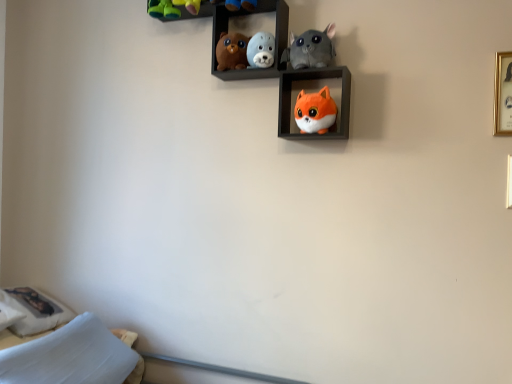
Question: From the image's perspective, is gold metallic picture frame at upper right on top of white soft pillow at lower left, the 1th pillow in the left-to-right sequence?

Choices:
 (A) no
 (B) yes

Answer: (B)

Question: Can you confirm if gold metallic picture frame at upper right is taller than white soft pillow at lower left, arranged as the 2th pillow when viewed from the right?

Choices:
 (A) no
 (B) yes

Answer: (B)

Question: Is white soft pillow at lower left, the 1th pillow in the left-to-right sequence, at the back of gold metallic picture frame at upper right?

Choices:
 (A) yes
 (B) no

Answer: (B)

Question: Is white soft pillow at lower left, the 1th pillow in the left-to-right sequence, located within gold metallic picture frame at upper right?

Choices:
 (A) yes
 (B) no

Answer: (B)

Question: From a real-world perspective, is gold metallic picture frame at upper right below white soft pillow at lower left, the 1th pillow in the left-to-right sequence?

Choices:
 (A) no
 (B) yes

Answer: (A)

Question: Can you confirm if gold metallic picture frame at upper right is bigger than white soft pillow at lower left, the 1th pillow in the left-to-right sequence?

Choices:
 (A) yes
 (B) no

Answer: (B)

Question: Considering the relative sizes of white soft pillow at lower left, arranged as the 2th pillow when viewed from the right, and matte brown plush bear at upper center, positioned as the first toy in left-to-right order, in the image provided, is white soft pillow at lower left, arranged as the 2th pillow when viewed from the right, bigger than matte brown plush bear at upper center, positioned as the first toy in left-to-right order,?

Choices:
 (A) no
 (B) yes

Answer: (B)

Question: Is white soft pillow at lower left, the 1th pillow in the left-to-right sequence, completely or partially outside of matte brown plush bear at upper center, positioned as the first toy in left-to-right order?

Choices:
 (A) no
 (B) yes

Answer: (B)

Question: Could matte brown plush bear at upper center, marked as the 4th toy in a right-to-left arrangement, be considered to be inside white soft pillow at lower left, the 1th pillow in the left-to-right sequence?

Choices:
 (A) yes
 (B) no

Answer: (B)

Question: Is white soft pillow at lower left, the 1th pillow in the left-to-right sequence, closer to the viewer compared to matte brown plush bear at upper center, positioned as the first toy in left-to-right order?

Choices:
 (A) no
 (B) yes

Answer: (A)

Question: From a real-world perspective, is white soft pillow at lower left, the 1th pillow in the left-to-right sequence, physically below matte brown plush bear at upper center, positioned as the first toy in left-to-right order?

Choices:
 (A) yes
 (B) no

Answer: (A)

Question: Would you consider white soft pillow at lower left, the 1th pillow in the left-to-right sequence, to be distant from matte brown plush bear at upper center, positioned as the first toy in left-to-right order?

Choices:
 (A) no
 (B) yes

Answer: (B)

Question: Considering the relative sizes of matte brown plush bear at upper center, marked as the 4th toy in a right-to-left arrangement, and orange plush toy at center, which ranks as the second shelf in left-to-right order, in the image provided, is matte brown plush bear at upper center, marked as the 4th toy in a right-to-left arrangement, wider than orange plush toy at center, which ranks as the second shelf in left-to-right order,?

Choices:
 (A) yes
 (B) no

Answer: (B)